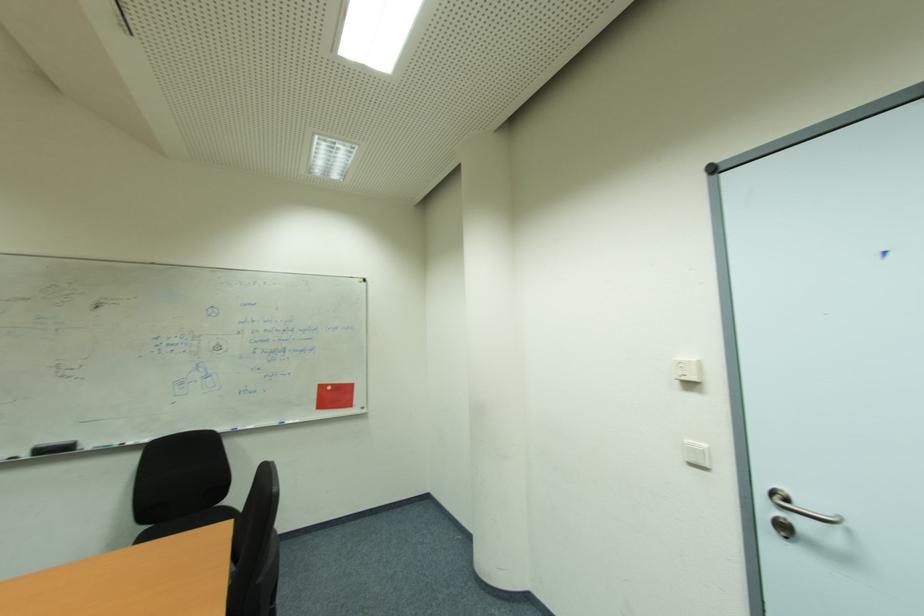
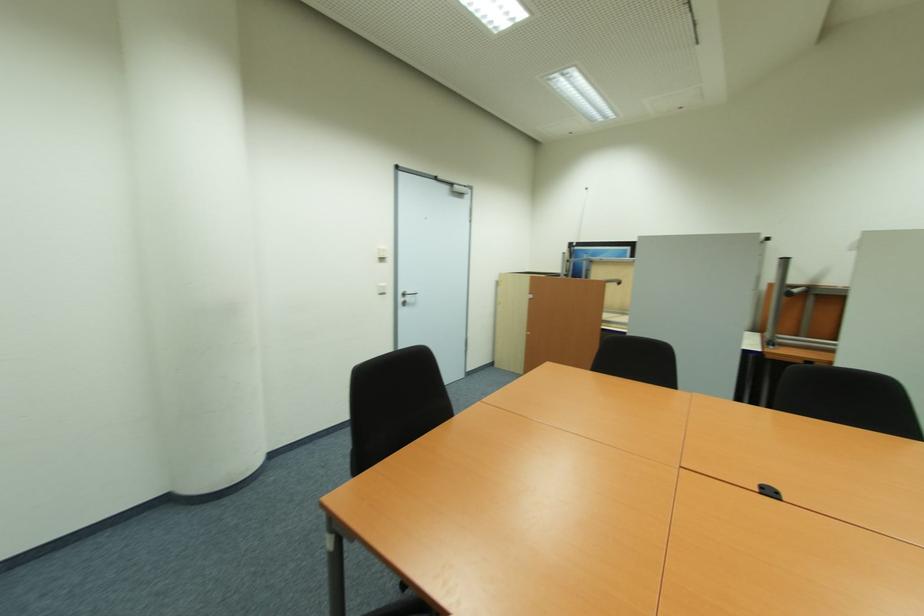
In the second image, find the point that corresponds to the point at 769,509 in the first image.

(405, 300)